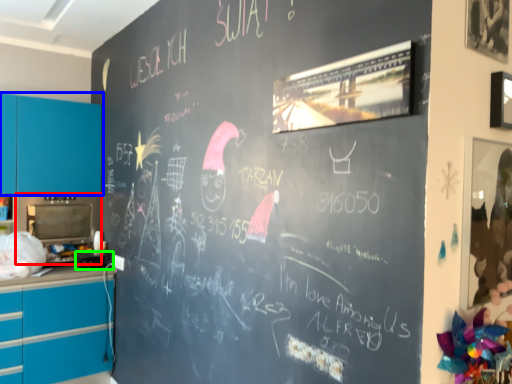
Question: Considering the real-world distances, which object is closest to appliance (highlighted by a red box)? cabinetry (highlighted by a blue box) or appliance (highlighted by a green box).

Choices:
 (A) cabinetry
 (B) appliance

Answer: (A)